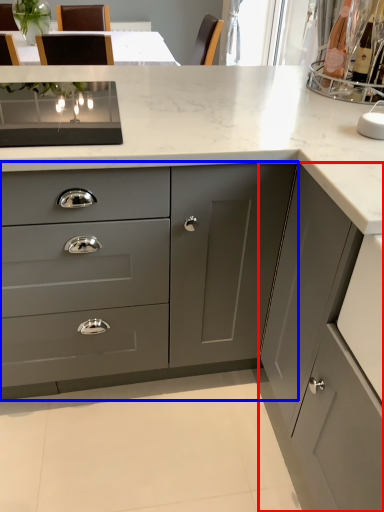
Question: Which object appears farthest to the camera in this image, cabinetry (highlighted by a red box) or cabinetry (highlighted by a blue box)?

Choices:
 (A) cabinetry
 (B) cabinetry

Answer: (B)